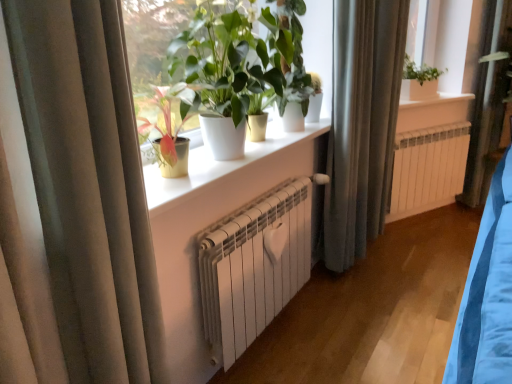
Find the location of a particular element. vacant space in front of silky gray curtain at center, the 1th curtain positioned from the back is located at coordinates (357, 294).